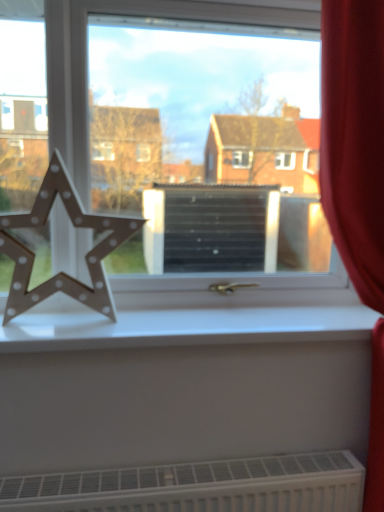
Question: From a real-world perspective, is red velvet curtain at right positioned over wooden star at left based on gravity?

Choices:
 (A) yes
 (B) no

Answer: (B)

Question: Is wooden star at left completely or partially inside red velvet curtain at right?

Choices:
 (A) yes
 (B) no

Answer: (B)

Question: Is red velvet curtain at right placed right next to wooden star at left?

Choices:
 (A) no
 (B) yes

Answer: (A)

Question: Does red velvet curtain at right turn towards wooden star at left?

Choices:
 (A) yes
 (B) no

Answer: (B)

Question: Is red velvet curtain at right behind wooden star at left?

Choices:
 (A) yes
 (B) no

Answer: (B)

Question: Is point (44, 328) closer or farther from the camera than point (253, 138)?

Choices:
 (A) closer
 (B) farther

Answer: (A)

Question: Considering the relative positions of white matte window sill at center and metallic star at left in the image provided, is white matte window sill at center to the left or to the right of metallic star at left?

Choices:
 (A) right
 (B) left

Answer: (A)

Question: Is white matte window sill at center in front of or behind metallic star at left in the image?

Choices:
 (A) behind
 (B) front

Answer: (B)

Question: From their relative heights in the image, would you say white matte window sill at center is taller or shorter than metallic star at left?

Choices:
 (A) tall
 (B) short

Answer: (B)

Question: From a real-world perspective, is wooden star at left positioned above or below red velvet curtain at right?

Choices:
 (A) below
 (B) above

Answer: (B)

Question: Is wooden star at left wider or thinner than red velvet curtain at right?

Choices:
 (A) thin
 (B) wide

Answer: (A)

Question: From the image's perspective, is wooden star at left above or below red velvet curtain at right?

Choices:
 (A) above
 (B) below

Answer: (A)

Question: In terms of height, does wooden star at left look taller or shorter compared to red velvet curtain at right?

Choices:
 (A) short
 (B) tall

Answer: (A)

Question: Considering the positions of red velvet curtain at right and wooden star at left in the image, is red velvet curtain at right taller or shorter than wooden star at left?

Choices:
 (A) tall
 (B) short

Answer: (A)

Question: Is red velvet curtain at right wider or thinner than wooden star at left?

Choices:
 (A) wide
 (B) thin

Answer: (A)